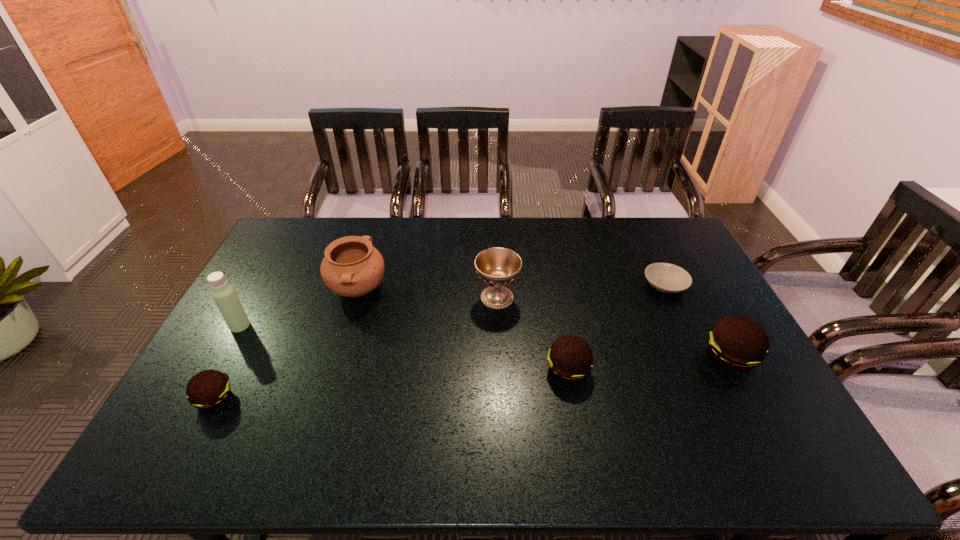
This screenshot has height=540, width=960. What are the coordinates of `free space for an extra patty_(food) to achieve even spacing` in the screenshot? It's located at (396, 384).